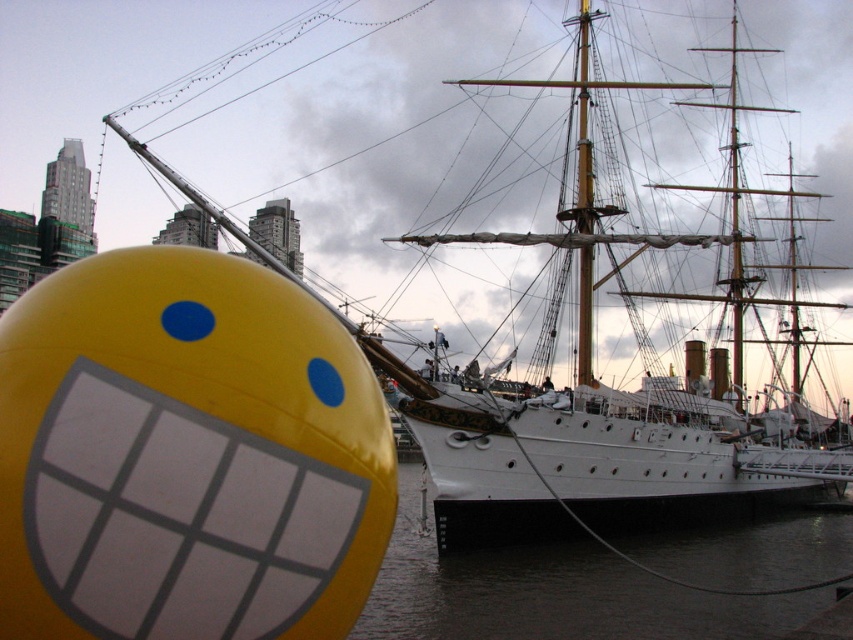
You are standing on a dock and see the yellow matte bobfloat at lower left and the dark water at lower center. Which object is closer to you?

The yellow matte bobfloat at lower left is positioned over dark water at lower center, so the bobfloat is closer to you than the water.

You are standing at the waterfront and see the yellow matte bobfloat at lower left. If you want to walk towards it, how far in meters do you need to walk?

The yellow matte bobfloat at lower left is 33.31 meters from the viewer, so you need to walk 33.31 meters to reach it.

You are standing on the dock near the historic ship and see the yellow matte bobfloat at lower left and the dark water at lower center. Which object is closer to your right side?

The dark water at lower center is closer to your right side because the yellow matte bobfloat at lower left is to the left of it.